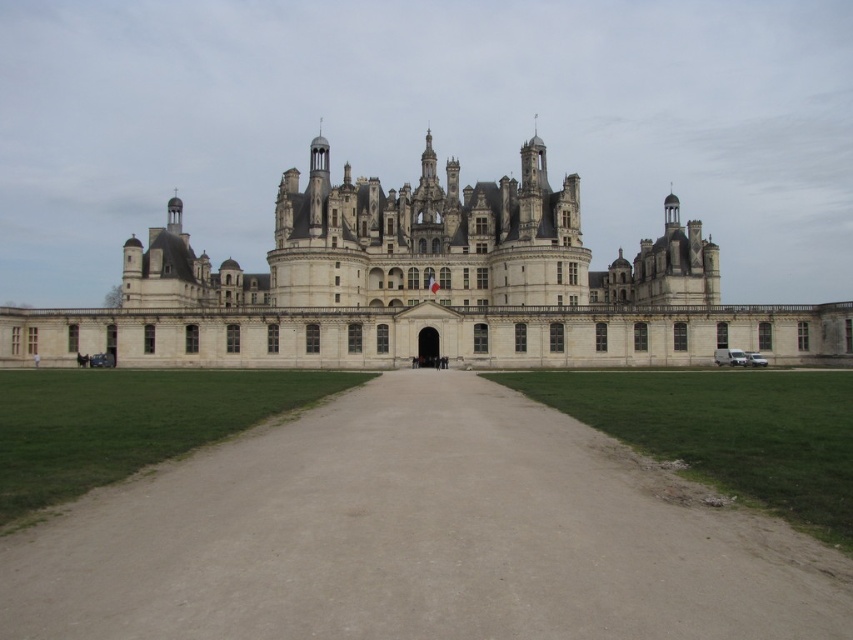
Question: Which of the following is the closest to the observer?

Choices:
 (A) (114, 333)
 (B) (820, 611)

Answer: (B)

Question: Where is dirt path at center located in relation to white stone castle at center in the image?

Choices:
 (A) left
 (B) right

Answer: (B)

Question: Can you confirm if dirt path at center is smaller than white stone castle at center?

Choices:
 (A) no
 (B) yes

Answer: (B)

Question: Is dirt path at center to the right of white stone castle at center from the viewer's perspective?

Choices:
 (A) yes
 (B) no

Answer: (A)

Question: Which point is closer to the camera taking this photo?

Choices:
 (A) (531, 477)
 (B) (701, 252)

Answer: (A)